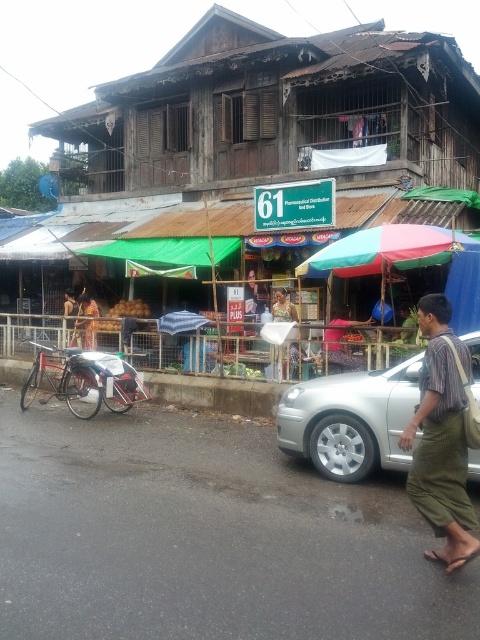
Question: Which point is closer to the camera?

Choices:
 (A) (251, 115)
 (B) (75, 320)
 (C) (451, 438)

Answer: (C)

Question: Which point is closer to the camera?

Choices:
 (A) (276, 304)
 (B) (85, 316)
 (C) (75, 330)
 (D) (371, 250)

Answer: (D)

Question: Which of the following is the farthest from the observer?

Choices:
 (A) tap(372, 177)
 (B) tap(407, 224)

Answer: (A)

Question: From the image, what is the correct spatial relationship of green fabric pants at lower right in relation to light brown wooden figure at center?

Choices:
 (A) above
 (B) below

Answer: (B)

Question: Is silver metallic car at center wider than multicolored fabric umbrella at center?

Choices:
 (A) yes
 (B) no

Answer: (B)

Question: Observing the image, what is the correct spatial positioning of wooden hut at center in reference to green fabric pants at lower right?

Choices:
 (A) right
 (B) left

Answer: (B)